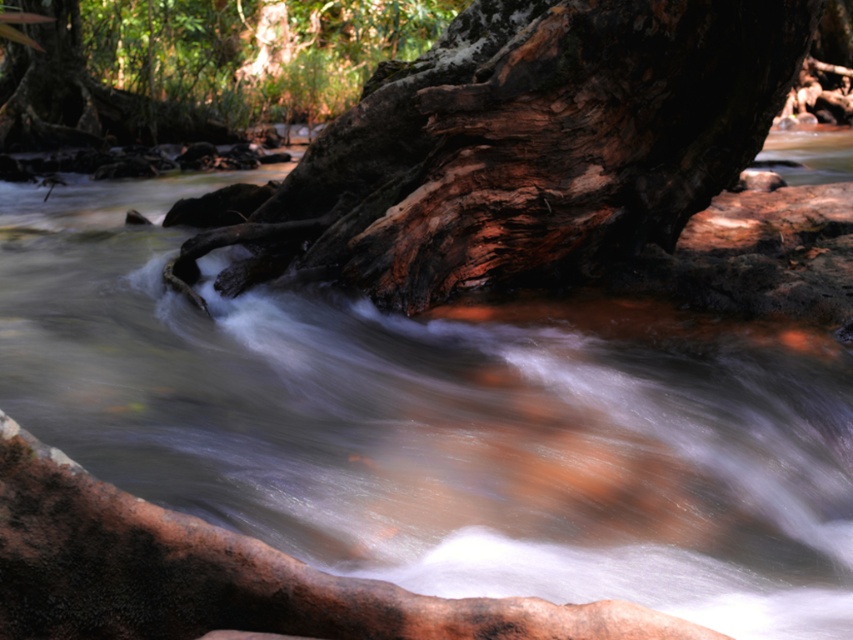
You are a nature photographer planning to capture a closeup of the rough bark tree trunk at center and the smooth bark tree at upper left. Which tree has a narrower trunk?

The rough bark tree trunk at center is narrower than the smooth bark tree at upper left.

In the scene shown: You are planning to place a 50 feet long wooden bridge across the stream. Based on the scene, will the distance between the rough bark tree trunk at center and the smooth bark tree at upper left be sufficient to support the bridge?

The rough bark tree trunk at center and the smooth bark tree at upper left are 49.58 feet apart. Since the bridge is 50 feet long, the distance between them is slightly shorter than the bridge, so the bridge cannot be placed between them.